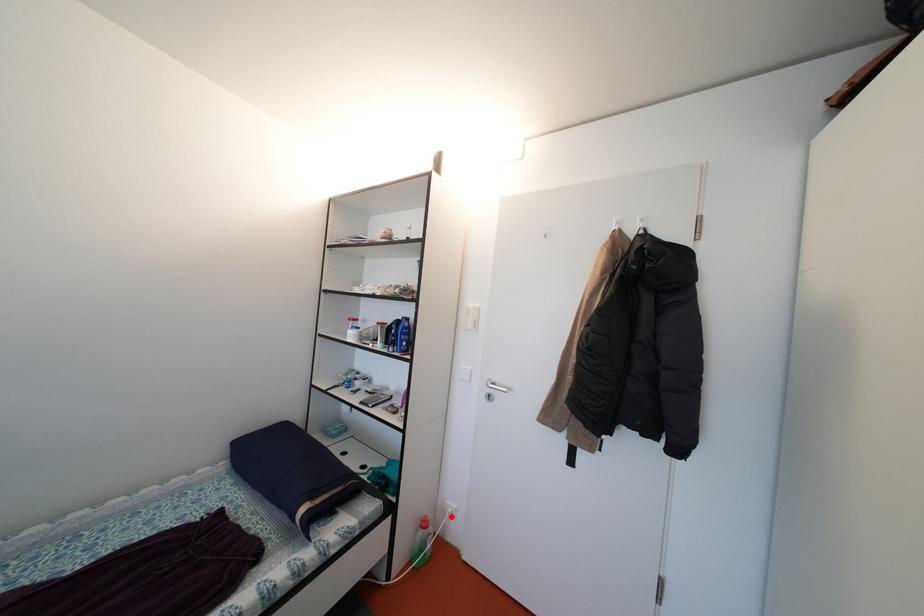
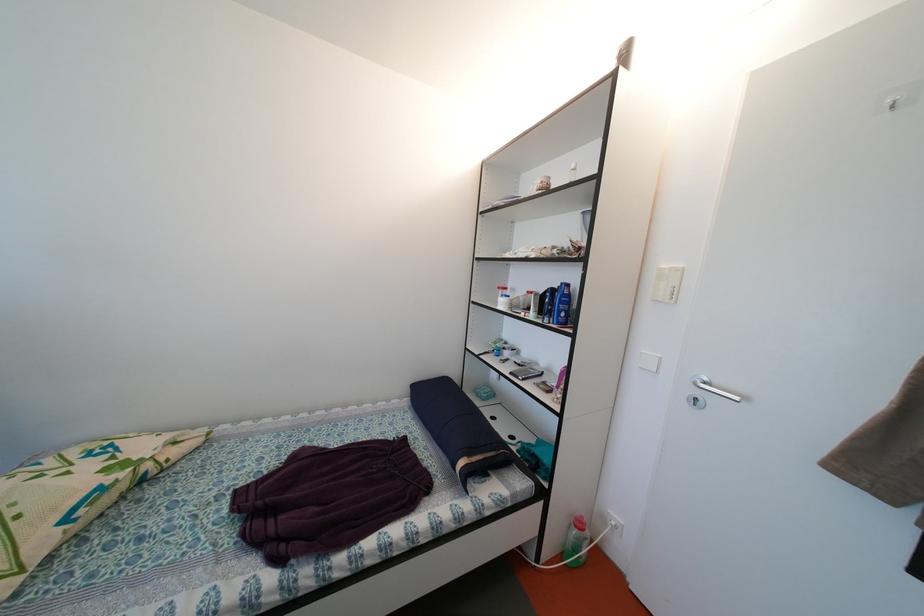
Question: I am providing you with two images of the same scene from different viewpoints. Given a red point in image1, look at the same physical point in image2. Is it:

Choices:
 (A) Closer to the viewpoint
 (B) Farther from the viewpoint

Answer: (A)